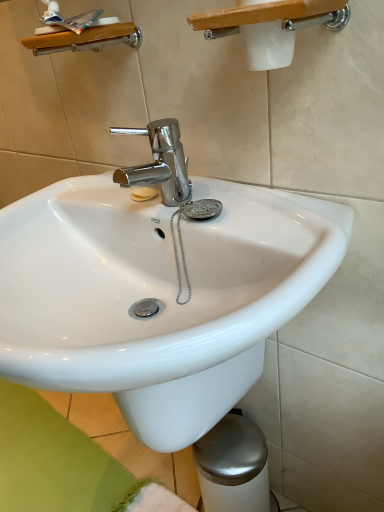
Question: In the image, is wooden shelf at upper left, the first shower in the back-to-front sequence, positioned in front of or behind white plastic shower at upper center, which is the first shower in front-to-back order?

Choices:
 (A) front
 (B) behind

Answer: (B)

Question: From a real-world perspective, is wooden shelf at upper left, the 1th shower viewed from the left, physically located above or below white plastic shower at upper center, the second shower in the left-to-right sequence?

Choices:
 (A) above
 (B) below

Answer: (A)

Question: Estimate the real-world distances between objects in this image. Which object is farther from the white plastic shower at upper center, the second shower in the left-to-right sequence?

Choices:
 (A) wooden shelf at upper left, which is the 2th shower in right-to-left order
 (B) white glossy sink at center

Answer: (B)

Question: Which object is positioned closest to the wooden shelf at upper left, the second shower from the front?

Choices:
 (A) white glossy sink at center
 (B) white plastic shower at upper center, the 1th shower positioned from the right

Answer: (B)